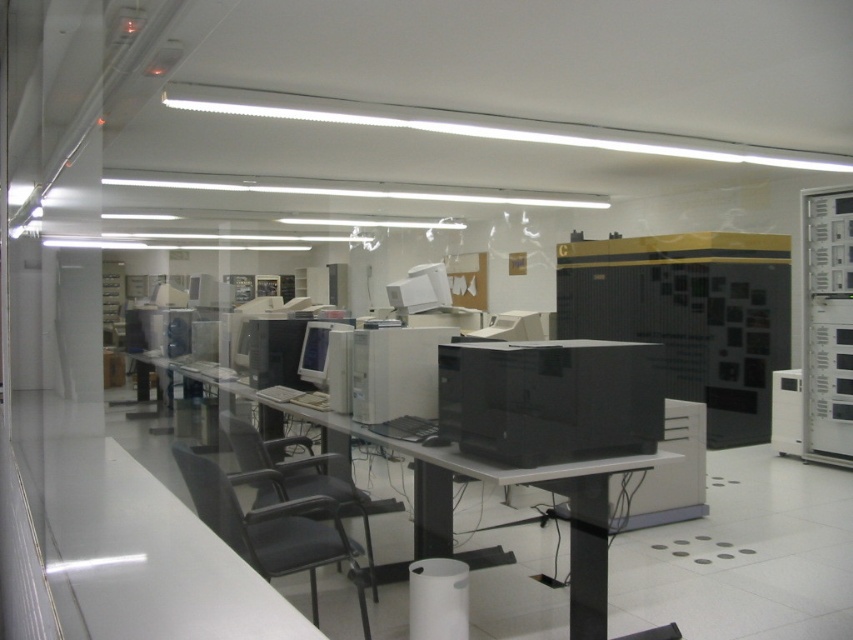
You are standing at point (x=590, y=630) and want to move to the door located at the opposite side of the room. The shortest path requires moving in a straight line. What is the minimum distance you need to travel to reach the door?

The minimum distance you need to travel to reach the door is 2.79 meters.